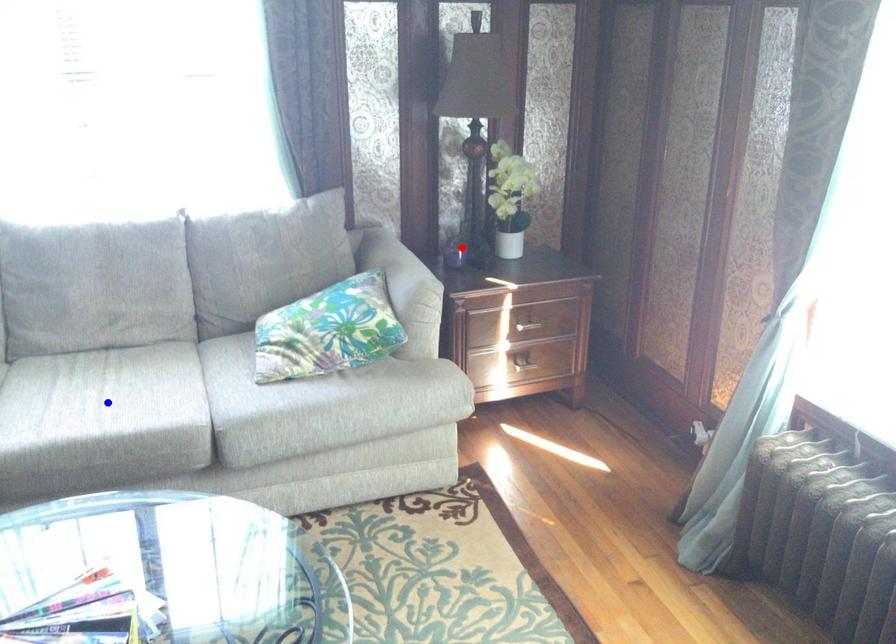
Question: In the image, two points are highlighted. Which point is nearer to the camera? Reply with the corresponding letter.

Choices:
 (A) blue point
 (B) red point

Answer: (A)